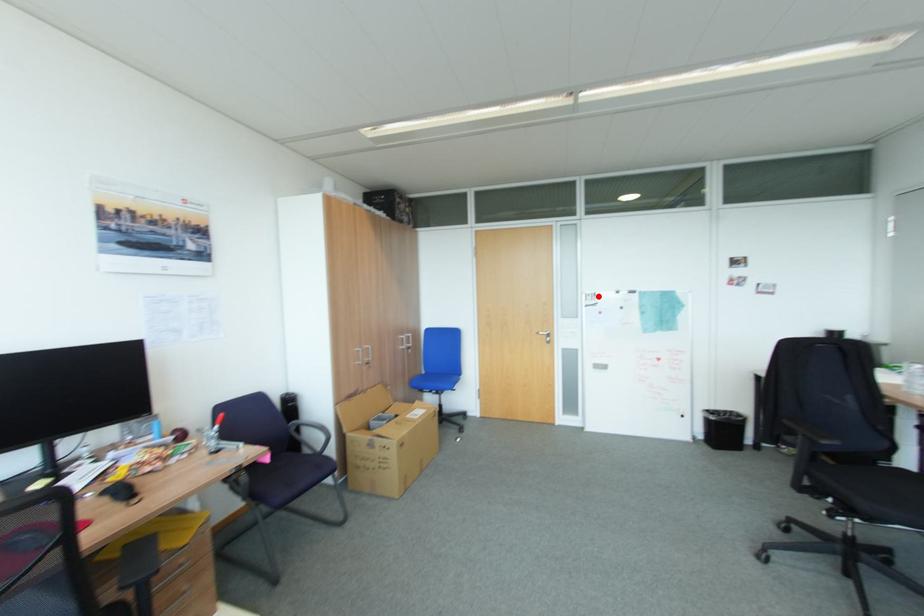
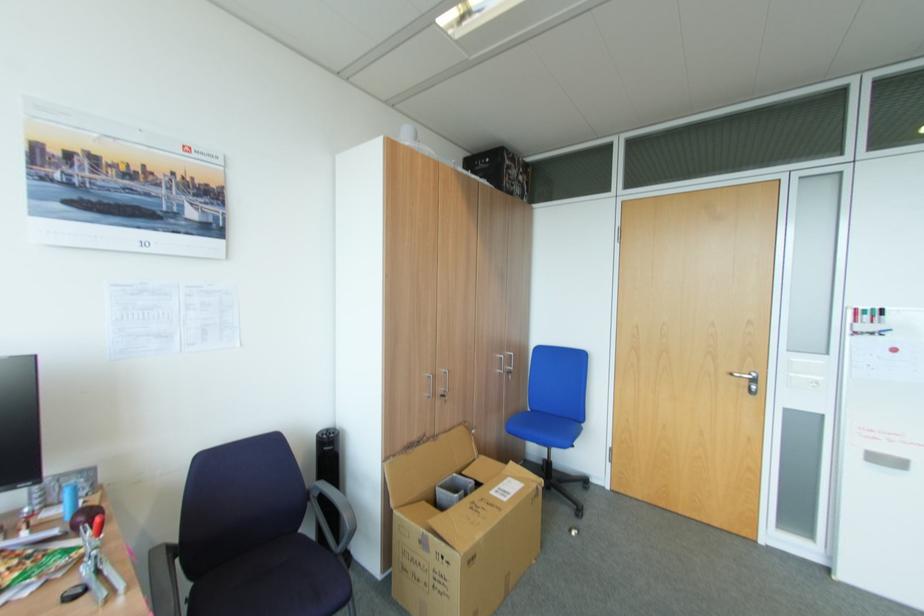
The point at the highlighted location is marked in the first image. Where is the corresponding point in the second image?

(880, 317)